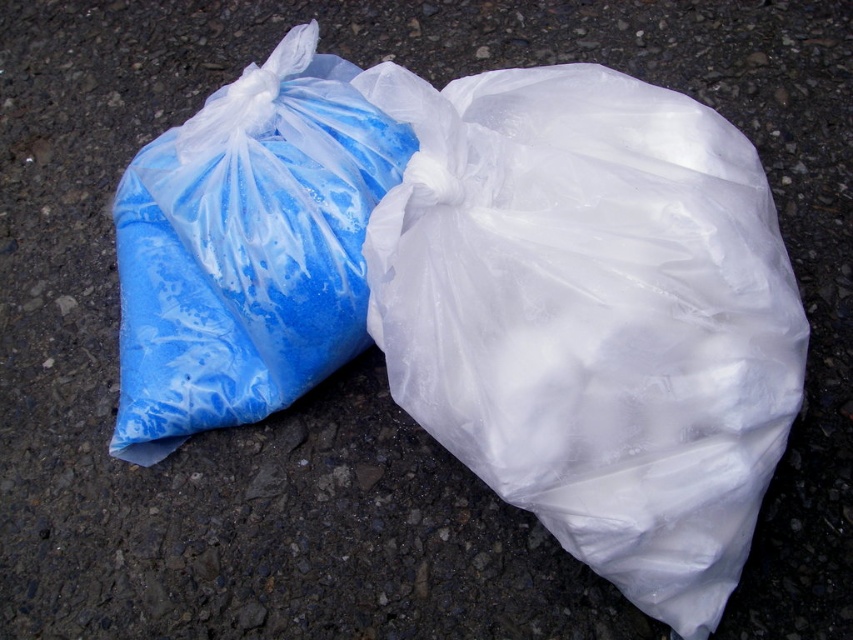
From the picture: Does transparent plastic bag at center appear on the right side of blue matte plastic bag at left?

Indeed, transparent plastic bag at center is positioned on the right side of blue matte plastic bag at left.

Can you confirm if transparent plastic bag at center is thinner than blue matte plastic bag at left?

Yes, transparent plastic bag at center is thinner than blue matte plastic bag at left.

Measure the distance between point (445,230) and camera.

A distance of 37.04 inches exists between point (445,230) and camera.

You are a GUI agent. You are given a task and a screenshot of the screen. Output one action in this format:
    pyautogui.click(x=<x>, y=<y>)
    Task: Click on the transparent plastic bag at center
    
    Given the screenshot: What is the action you would take?
    pyautogui.click(x=592, y=316)